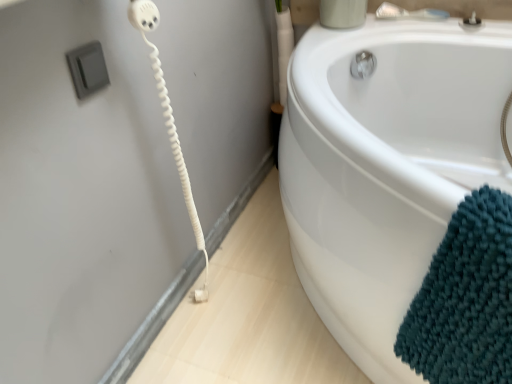
Question: From their relative heights in the image, would you say teal chenille bath towel at lower right is taller or shorter than silver metallic faucet at upper right?

Choices:
 (A) tall
 (B) short

Answer: (A)

Question: From the image's perspective, is teal chenille bath towel at lower right located above or below silver metallic faucet at upper right?

Choices:
 (A) above
 (B) below

Answer: (B)

Question: In terms of size, does teal chenille bath towel at lower right appear bigger or smaller than silver metallic faucet at upper right?

Choices:
 (A) small
 (B) big

Answer: (B)

Question: Does point (411, 14) appear closer or farther from the camera than point (458, 264)?

Choices:
 (A) farther
 (B) closer

Answer: (A)

Question: Is silver metallic faucet at upper right in front of or behind teal chenille bath towel at lower right in the image?

Choices:
 (A) front
 (B) behind

Answer: (B)

Question: In the image, is silver metallic faucet at upper right on the left side or the right side of teal chenille bath towel at lower right?

Choices:
 (A) right
 (B) left

Answer: (A)

Question: From the image's perspective, is silver metallic faucet at upper right positioned above or below teal chenille bath towel at lower right?

Choices:
 (A) above
 (B) below

Answer: (A)